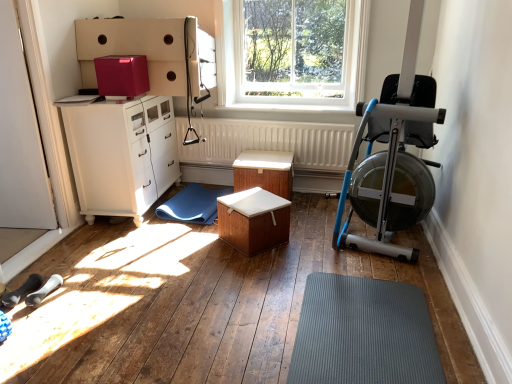
In order to click on free point above wooden box at center, the 2th table positioned from the back (from a real-world perspective) in this screenshot , I will do `click(248, 201)`.